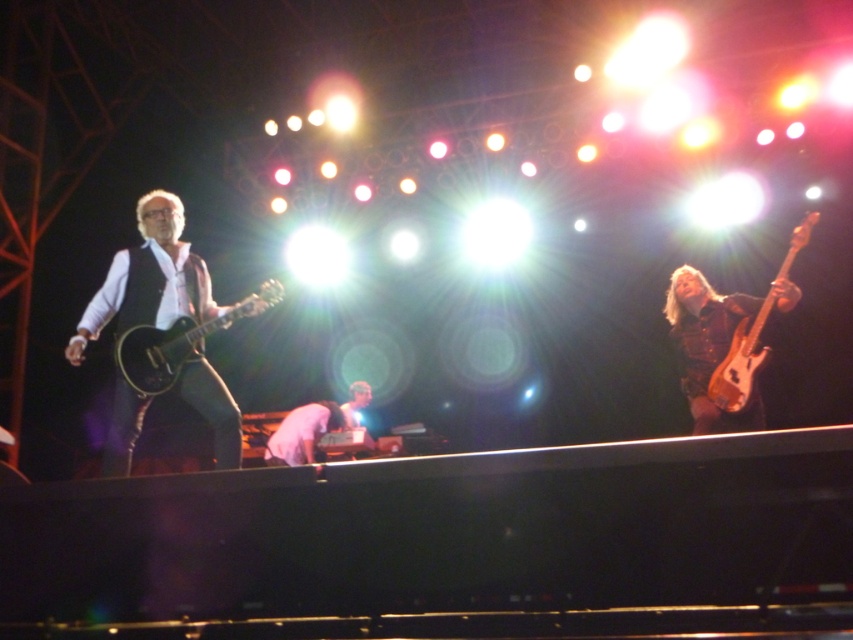
Question: Which object is positioned closest to the shiny black electric guitar at left?

Choices:
 (A) matte black guitar at left
 (B) pink fabric shirt at center

Answer: (A)

Question: Which object is positioned farthest from the shiny black electric guitar at left?

Choices:
 (A) pink fabric shirt at center
 (B) wooden electric guitar at right

Answer: (B)

Question: Which of these objects is positioned closest to the pink fabric shirt at center?

Choices:
 (A) wooden electric guitar at right
 (B) matte black guitar at left

Answer: (B)

Question: Can you confirm if matte black guitar at left is smaller than wooden electric guitar at right?

Choices:
 (A) no
 (B) yes

Answer: (A)

Question: Does wooden electric guitar at right appear on the left side of pink fabric shirt at center?

Choices:
 (A) no
 (B) yes

Answer: (A)

Question: Is matte black guitar at left smaller than wooden electric guitar at right?

Choices:
 (A) no
 (B) yes

Answer: (A)